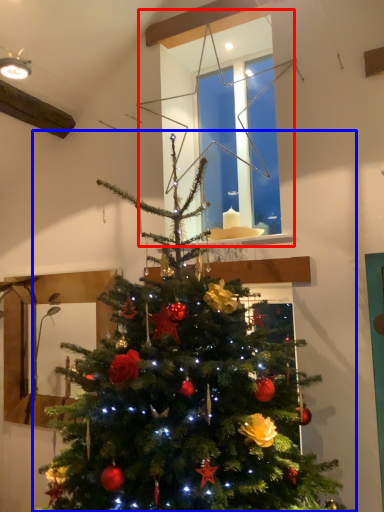
Question: Among these objects, which one is nearest to the camera, window (highlighted by a red box) or christmas tree (highlighted by a blue box)?

Choices:
 (A) window
 (B) christmas tree

Answer: (B)